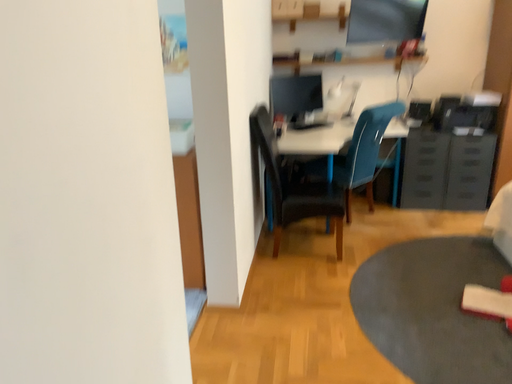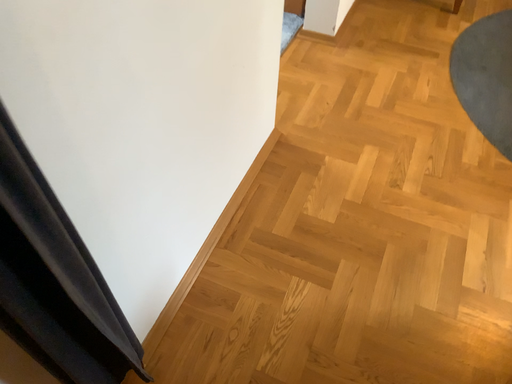
Question: Which way did the camera rotate in the video?

Choices:
 (A) rotated left
 (B) rotated right

Answer: (A)